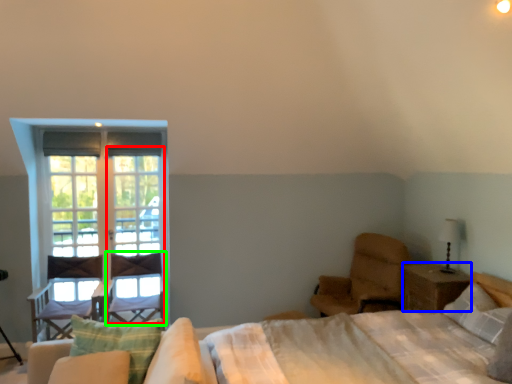
Question: Estimate the real-world distances between objects in this image. Which object is farther from screen door (highlighted by a red box), nightstand (highlighted by a blue box) or swivel chair (highlighted by a green box)?

Choices:
 (A) nightstand
 (B) swivel chair

Answer: (A)